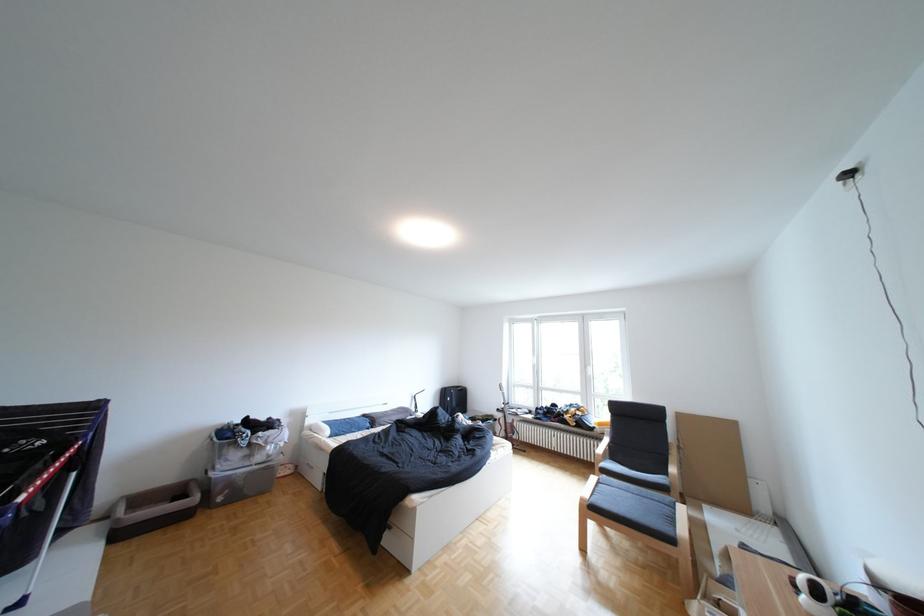
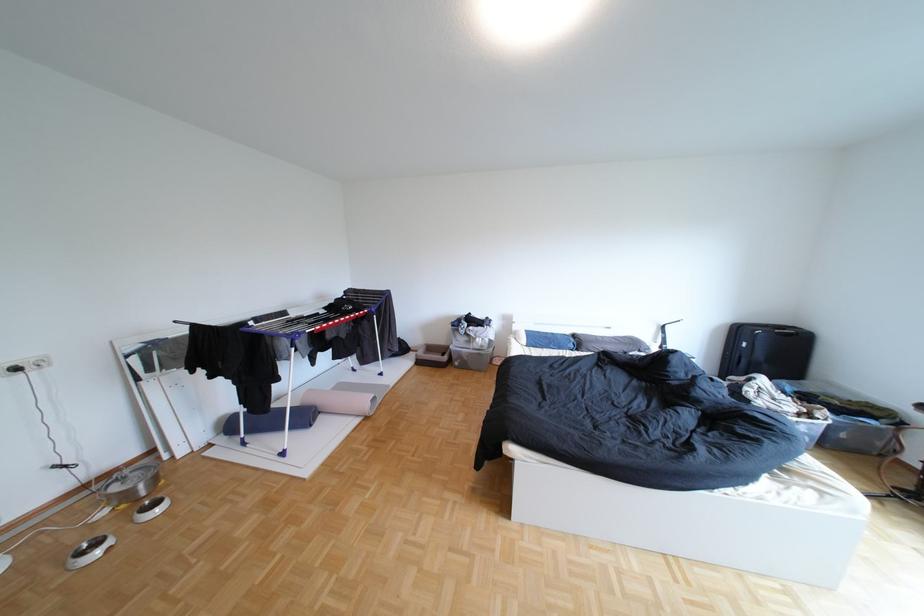
Find the pixel in the second image that matches (380,416) in the first image.

(590, 336)